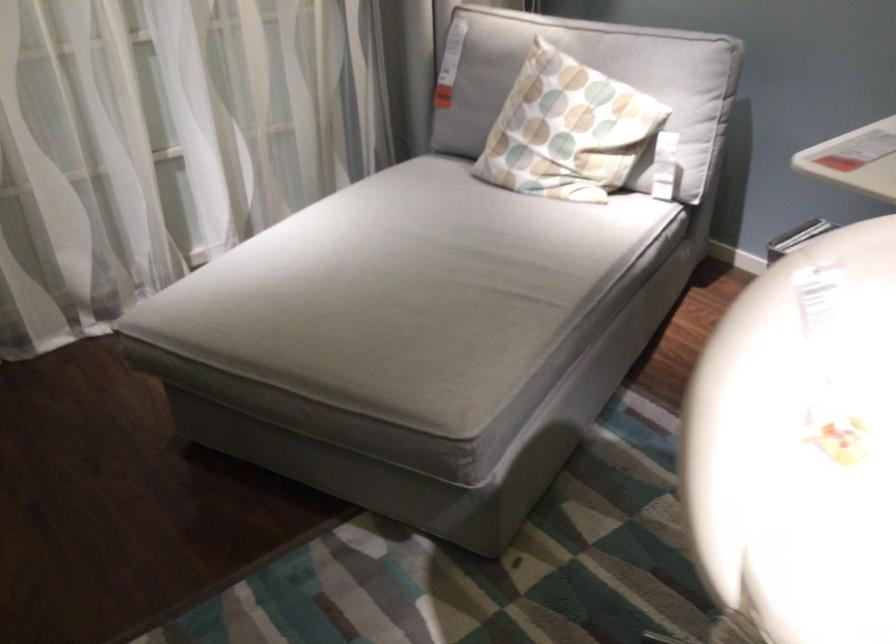
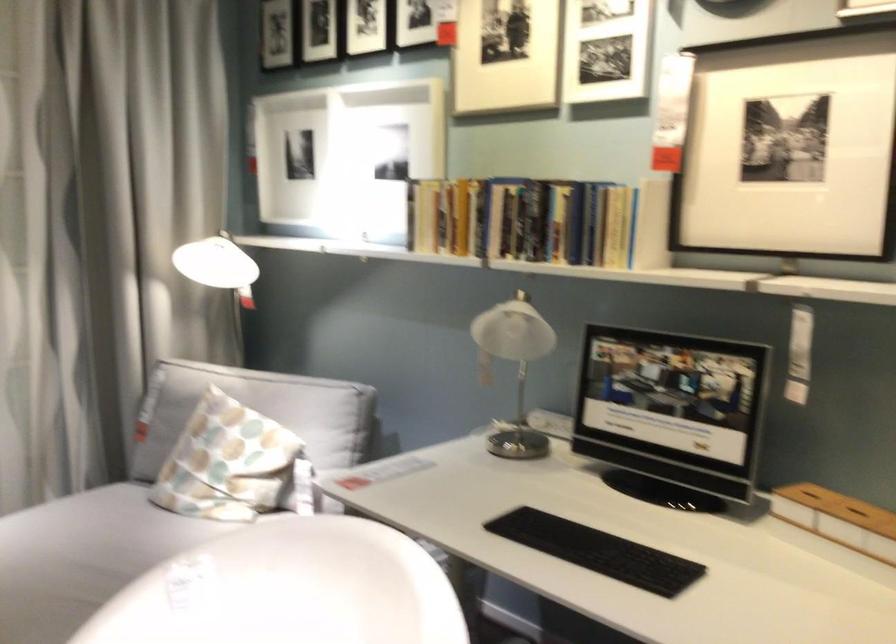
From the picture: In a continuous first-person perspective shot, in which direction is the camera moving?

The cameraman moved toward right, backward.